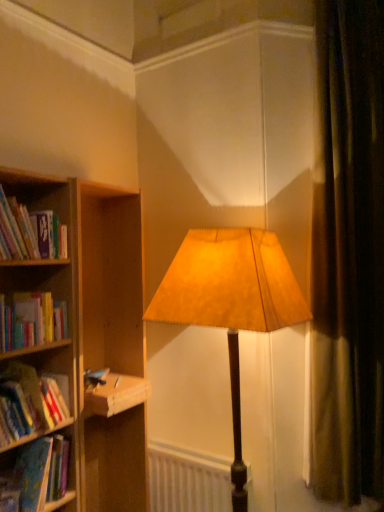
Question: Considering the relative positions of hardcover book at left and hardcover book at left, which ranks as the 1th book in top-to-bottom order, in the image provided, is hardcover book at left behind hardcover book at left, which ranks as the 1th book in top-to-bottom order,?

Choices:
 (A) no
 (B) yes

Answer: (B)

Question: Is hardcover book at left at the left side of hardcover book at left, the 4th book from the bottom?

Choices:
 (A) yes
 (B) no

Answer: (B)

Question: Can you confirm if hardcover book at left is smaller than hardcover book at left, which ranks as the 1th book in top-to-bottom order?

Choices:
 (A) yes
 (B) no

Answer: (A)

Question: Does hardcover book at left touch hardcover book at left, the 4th book from the bottom?

Choices:
 (A) no
 (B) yes

Answer: (A)

Question: Could you tell me if hardcover book at left is turned towards hardcover book at left, which ranks as the 1th book in top-to-bottom order?

Choices:
 (A) no
 (B) yes

Answer: (A)

Question: Is hardcover book at left, the 3th book positioned from the bottom, taller or shorter than hardcover book at left, which ranks as the 1th book in top-to-bottom order?

Choices:
 (A) short
 (B) tall

Answer: (A)

Question: In terms of size, does hardcover book at left, the 3th book positioned from the bottom, appear bigger or smaller than hardcover book at left, which ranks as the 1th book in top-to-bottom order?

Choices:
 (A) small
 (B) big

Answer: (A)

Question: Relative to hardcover book at left, the 4th book from the bottom, is hardcover book at left, which is the 2th book from top to bottom, in front or behind?

Choices:
 (A) behind
 (B) front

Answer: (A)

Question: From a real-world perspective, relative to hardcover book at left, the 4th book from the bottom, is hardcover book at left, the 3th book positioned from the bottom, vertically above or below?

Choices:
 (A) below
 (B) above

Answer: (A)

Question: Visually, is hardcover book at left positioned to the left or to the right of white matte radiator at lower center?

Choices:
 (A) right
 (B) left

Answer: (B)

Question: In terms of height, does hardcover book at left look taller or shorter compared to white matte radiator at lower center?

Choices:
 (A) tall
 (B) short

Answer: (B)

Question: Is point (102, 415) positioned closer to the camera than point (157, 490)?

Choices:
 (A) farther
 (B) closer

Answer: (B)

Question: Is hardcover book at left situated inside white matte radiator at lower center or outside?

Choices:
 (A) outside
 (B) inside

Answer: (A)

Question: Which is correct: brown velvet curtain at right is inside hardcover book at left, which is the 2th book from top to bottom, or outside of it?

Choices:
 (A) outside
 (B) inside

Answer: (A)

Question: From a real-world perspective, is brown velvet curtain at right positioned above or below hardcover book at left, the 3th book positioned from the bottom?

Choices:
 (A) above
 (B) below

Answer: (A)